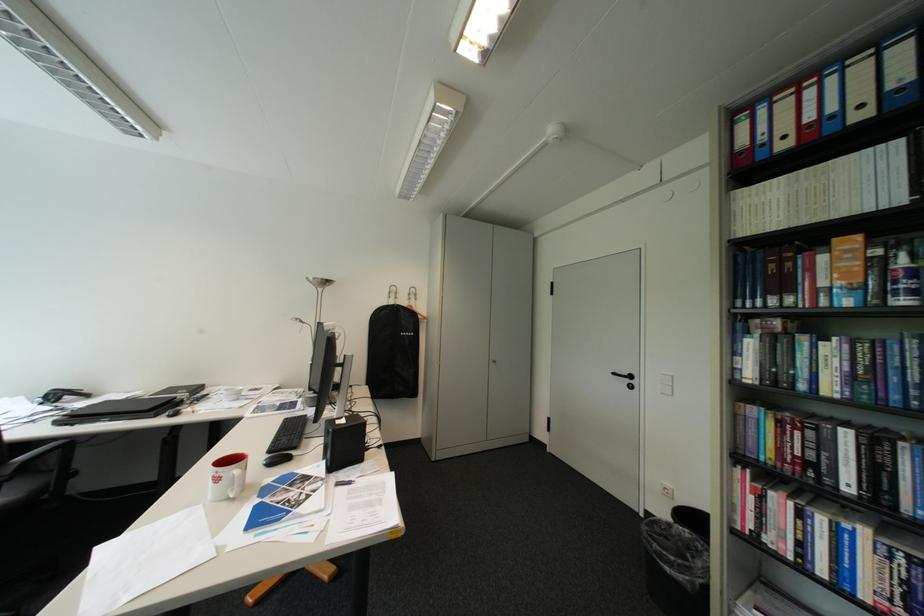
Find where to pull the red binder pull-hole. Please return your answer as a coordinate pair (x, y).

(807, 123)